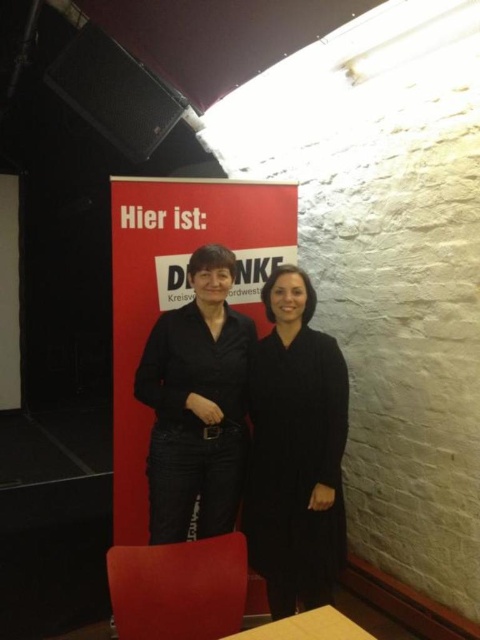
Question: Which of the following is the closest to the observer?

Choices:
 (A) yellow matte table at lower center
 (B) black matte jacket at center

Answer: (A)

Question: Can you confirm if black wool coat at center is positioned to the left of red matte banner at center?

Choices:
 (A) yes
 (B) no

Answer: (B)

Question: Does black wool coat at center have a smaller size compared to red matte banner at center?

Choices:
 (A) yes
 (B) no

Answer: (A)

Question: Which object is positioned farthest from the yellow matte table at lower center?

Choices:
 (A) black matte jacket at center
 (B) black wool coat at center

Answer: (A)

Question: Which of the following is the farthest from the observer?

Choices:
 (A) red matte banner at center
 (B) yellow matte table at lower center
 (C) black matte jacket at center

Answer: (A)

Question: Is black wool coat at center to the left of yellow matte table at lower center from the viewer's perspective?

Choices:
 (A) yes
 (B) no

Answer: (B)